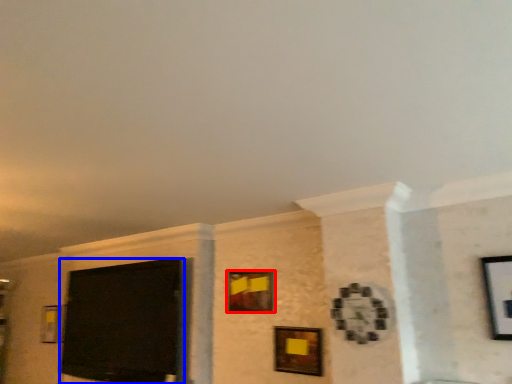
Question: Which object is further to the camera taking this photo, picture frame (highlighted by a red box) or projection screen (highlighted by a blue box)?

Choices:
 (A) picture frame
 (B) projection screen

Answer: (B)